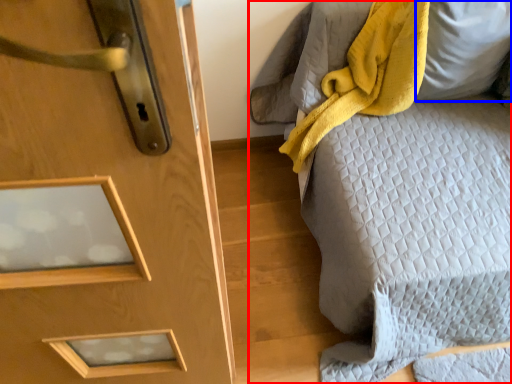
Question: Which point is further to the camera, furniture (highlighted by a red box) or pillow (highlighted by a blue box)?

Choices:
 (A) furniture
 (B) pillow

Answer: (B)